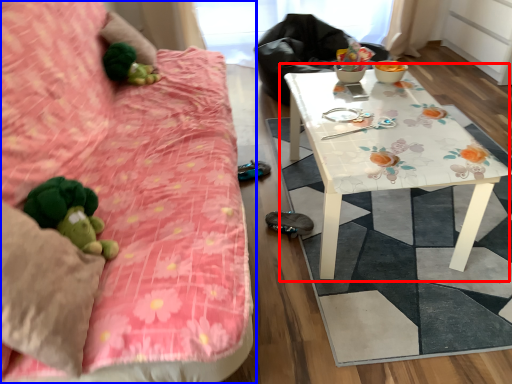
Question: Which of the following is the closest to the observer, table (highlighted by a red box) or studio couch (highlighted by a blue box)?

Choices:
 (A) table
 (B) studio couch

Answer: (B)